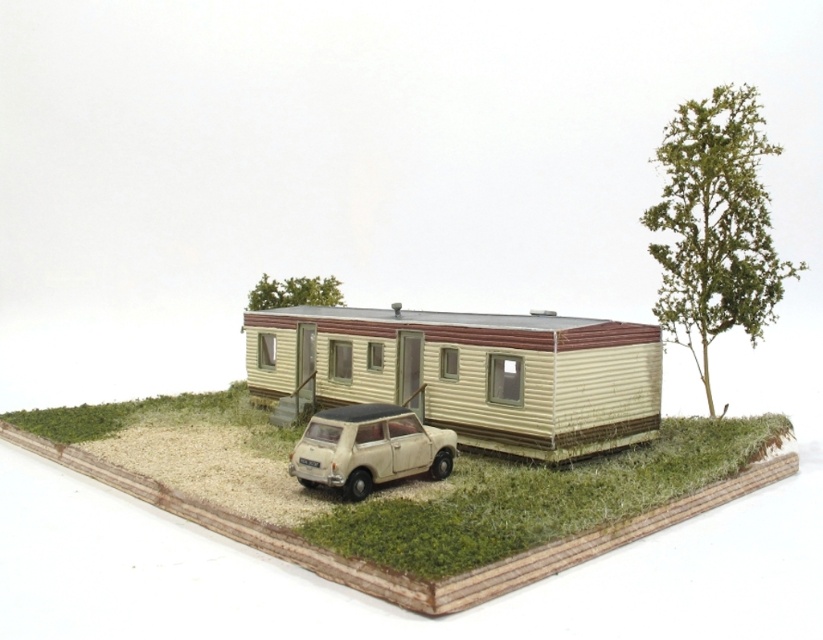
You are standing at the point marked by the coordinates point (537, 499) in the scene. Looking around, you see the mobile home and the small car. Which direction should you face to see the mobile home?

The point (537, 499) marks green grass at lower center. Since the mobile home is placed on a raised platform made of brick or stone, which elevates it slightly, facing upward from the lower center position would direct your gaze toward the mobile home.

You are planning to plant a new tree between the green textured tree at upper right and the green leafy tree at upper center. The new tree requires a minimum of 8 feet of space between it and any existing trees. Based on the current spacing between the existing trees, is this possible?

The green textured tree at upper right and the green leafy tree at upper center are 6.49 feet apart. Since the required minimum space for the new tree is 8 feet, planting between them would not provide enough space. You need to find another location.

You are a delivery drone trying to land at the mobile home. The landing pad is at point (368, 449). You see the white matte car at center. Is there enough space to land safely?

The landing pad at point (368, 449) is occupied by the white matte car at center, so the drone cannot land there safely.